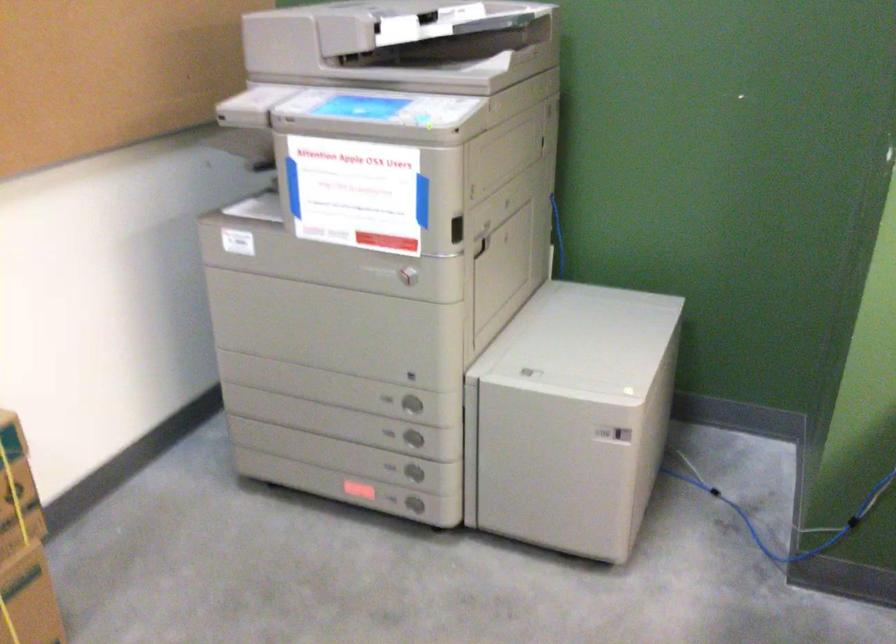
I want to click on red circular switch, so click(x=358, y=489).